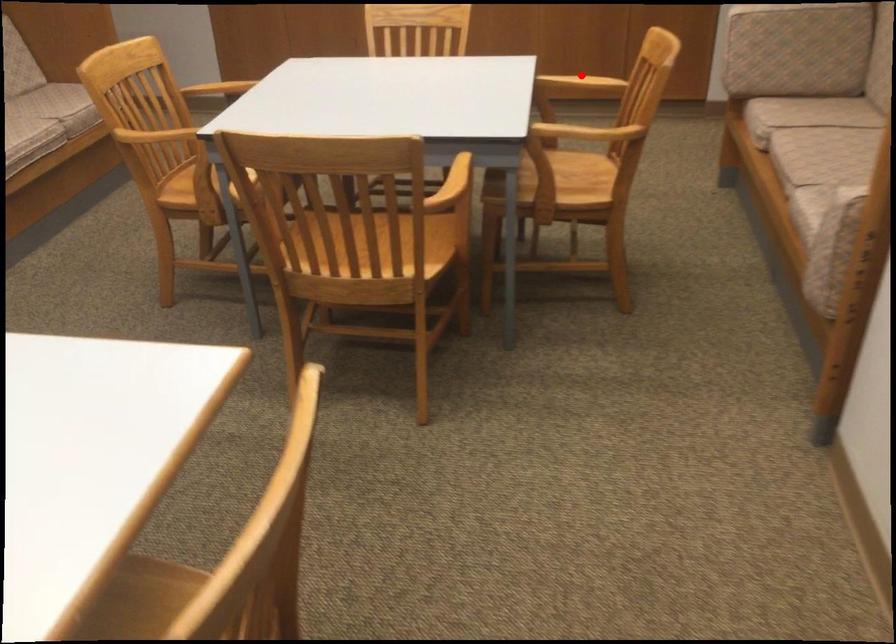
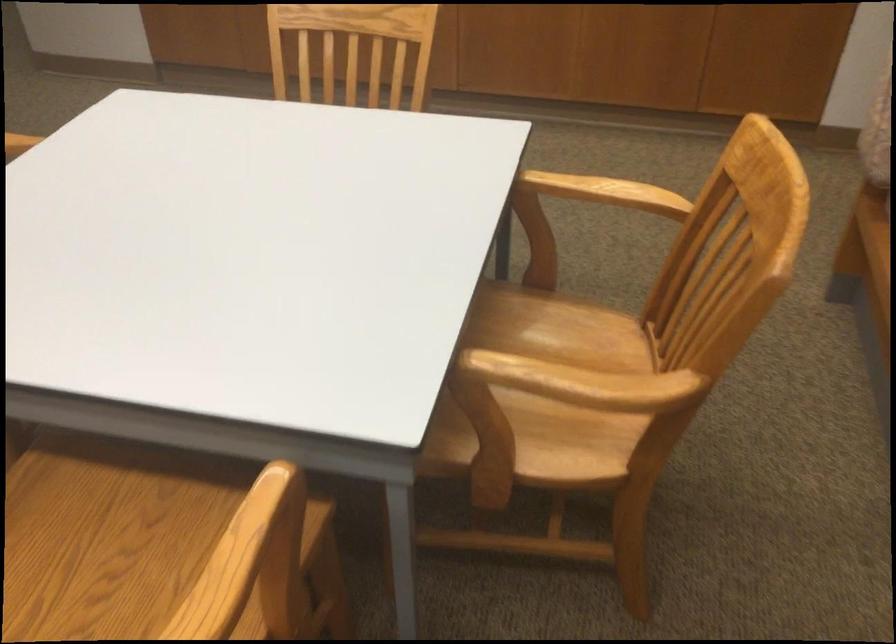
Question: I am providing you with two images of the same scene from different viewpoints. A red point is shown in image1. For the corresponding object point in image2, is it positioned nearer or farther from the camera?

Choices:
 (A) Nearer
 (B) Farther

Answer: (A)